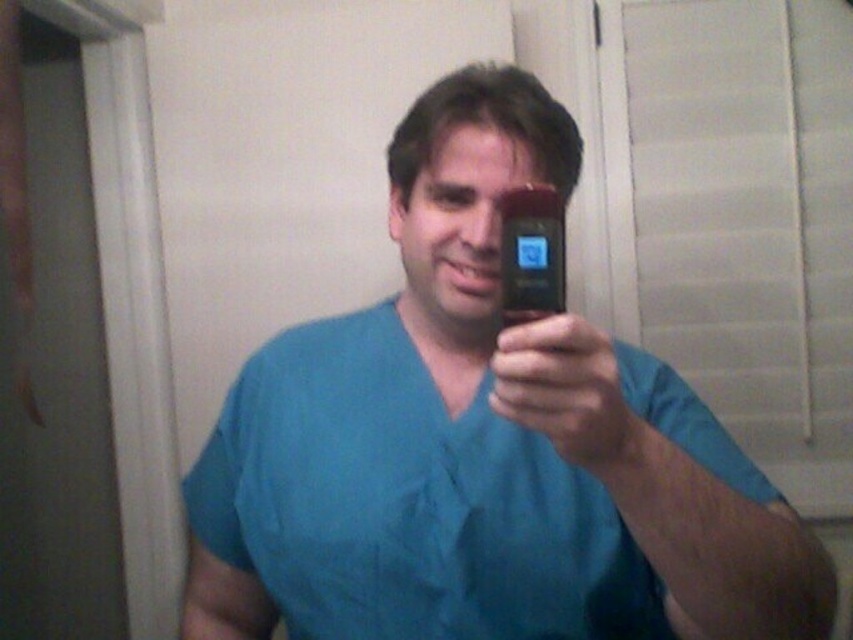
Question: Which point is farther to the camera?

Choices:
 (A) black matte phone at center
 (B) black glossy smartphone at center

Answer: (B)

Question: Among these objects, which one is farthest from the camera?

Choices:
 (A) blue fabric shirt at center
 (B) black glossy smartphone at center
 (C) black matte phone at center

Answer: (B)

Question: Observing the image, what is the correct spatial positioning of blue fabric shirt at center in reference to black matte phone at center?

Choices:
 (A) below
 (B) above

Answer: (A)

Question: Does black matte phone at center appear on the right side of black glossy smartphone at center?

Choices:
 (A) yes
 (B) no

Answer: (A)

Question: Does blue fabric shirt at center appear on the left side of black matte phone at center?

Choices:
 (A) yes
 (B) no

Answer: (A)

Question: Which of the following is the farthest from the observer?

Choices:
 (A) (653, 444)
 (B) (558, 216)
 (C) (527, 397)

Answer: (A)